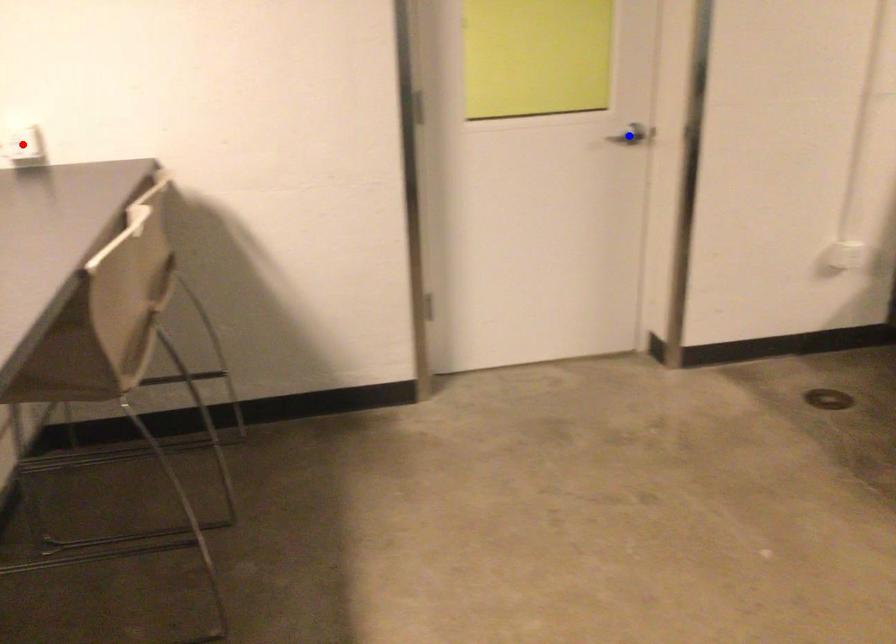
Question: Two points are marked on the image. Which point is closer to the camera?

Choices:
 (A) Blue point is closer.
 (B) Red point is closer.

Answer: (B)